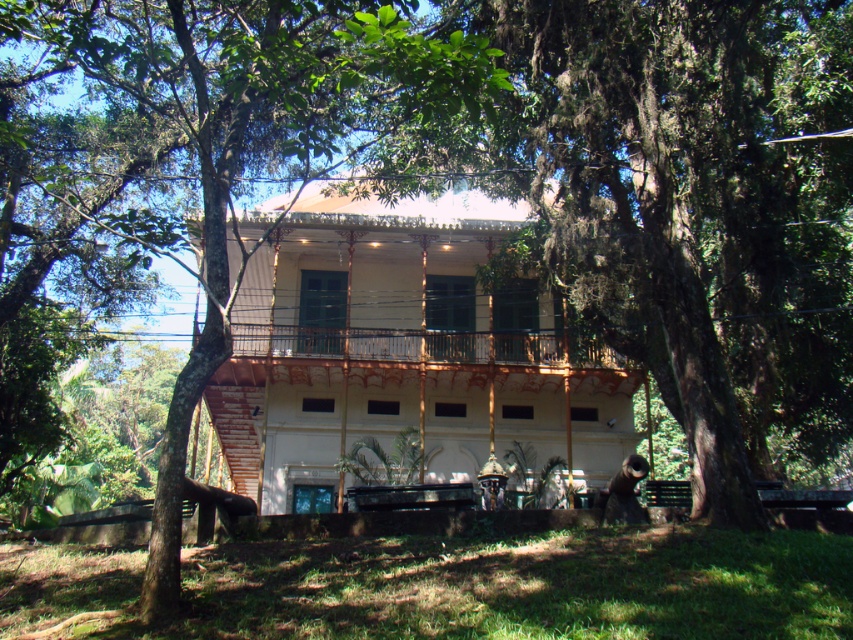
You are standing in front of the two story building and want to know the location of the green leafy tree at center. What are its coordinates?

The green leafy tree at center is located at coordinates point (281, 138).

You are standing in front of the two story building and want to determine which object at the center has a smaller width between the green leafy tree at center and the rustic wood porch at center. Which one is it?

The green leafy tree at center is thinner than the rustic wood porch at center, so the green leafy tree at center has a smaller width.